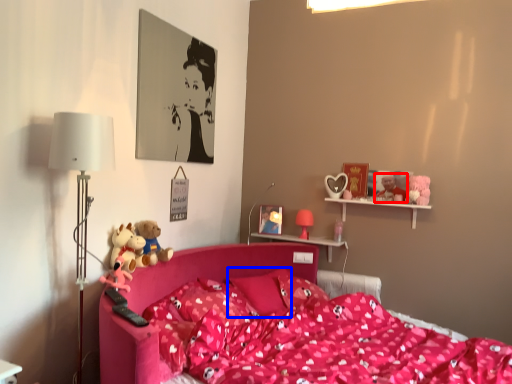
Question: Which object is closer to the camera taking this photo, toy (highlighted by a red box) or pillow (highlighted by a blue box)?

Choices:
 (A) toy
 (B) pillow

Answer: (B)